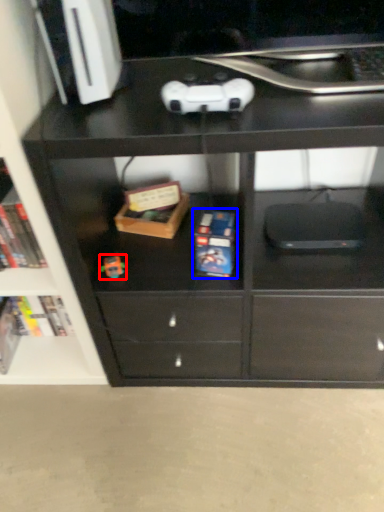
Question: Which point is closer to the camera, toy (highlighted by a red box) or paperback book (highlighted by a blue box)?

Choices:
 (A) toy
 (B) paperback book

Answer: (B)